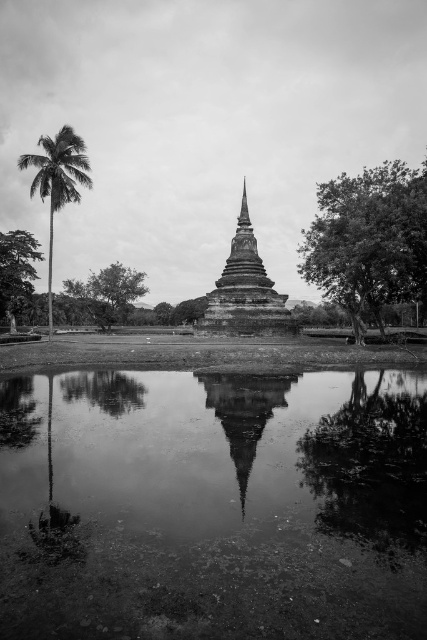
Is smooth glass water at center closer to camera compared to green leafy tree at center?

Yes, it is.

Does smooth glass water at center have a smaller size compared to green leafy tree at center?

Yes.

Between point (243, 460) and point (131, 284), which one is positioned behind?

Positioned behind is point (131, 284).

Identify the location of smooth glass water at center. This screenshot has height=640, width=427. (243, 413).

Which is above, smooth green tree at left or green leafy tree at center?

green leafy tree at center is higher up.

Can you confirm if smooth green tree at left is positioned above green leafy tree at center?

Incorrect, smooth green tree at left is not positioned above green leafy tree at center.

Does point (17, 301) come closer to viewer compared to point (94, 276)?

No, (17, 301) is behind (94, 276).

This screenshot has width=427, height=640. What are the coordinates of `smooth green tree at left` in the screenshot? It's located at (17, 269).

Describe the element at coordinates (215, 508) in the screenshot. I see `transparent water at center` at that location.

Locate an element on the screen. transparent water at center is located at coordinates (215, 508).